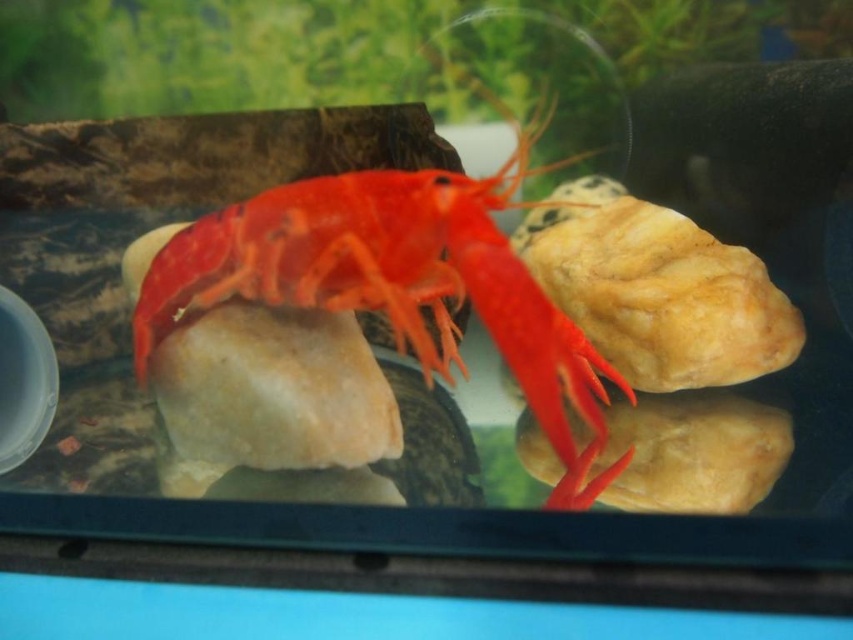
Is shiny orange lobster at center wider than smooth beige rock at center?

Yes, shiny orange lobster at center is wider than smooth beige rock at center.

Who is higher up, shiny orange lobster at center or smooth beige rock at center?

shiny orange lobster at center is higher up.

Does point (566, 438) lie behind point (729, 422)?

No, it is not.

This screenshot has width=853, height=640. Find the location of `shiny orange lobster at center`. shiny orange lobster at center is located at coordinates (398, 282).